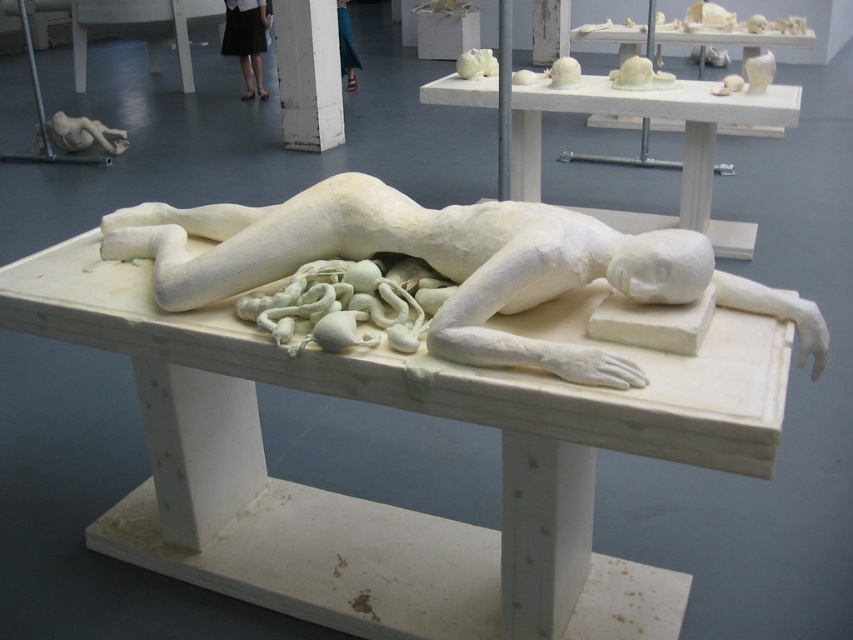
You are an art curator planning to move the white marble table at center and the white matte table at upper center to a new gallery space. The entrance of the new gallery has a doorway that is 1.2 meters wide. Can both tables fit through the doorway if placed side by side horizontally?

The white marble table at center is smaller than the white matte table at upper center. Since the doorway is 1.2 meters wide, the combined width of both tables must be less than or equal to 1.2 meters. However, without knowing the exact dimensions of each table, it is impossible to determine if they can fit through the doorway when placed side by side horizontally.

In the scene shown: You are an art critic standing in front of the installation. You notice the white matte sculpture at center and the black skirt at upper center. Which object is positioned closer to you?

The white matte sculpture at center is closer to the viewer than the black skirt at upper center.